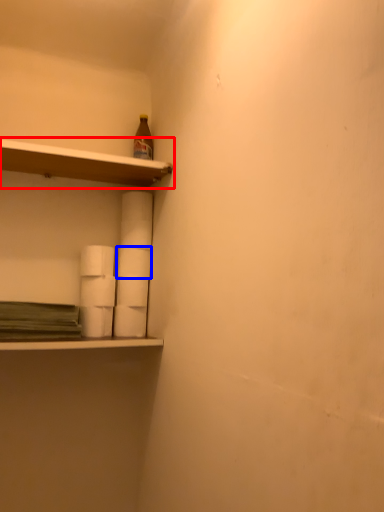
Question: Which object appears farthest to the camera in this image, shelf (highlighted by a red box) or paper towel (highlighted by a blue box)?

Choices:
 (A) shelf
 (B) paper towel

Answer: (B)